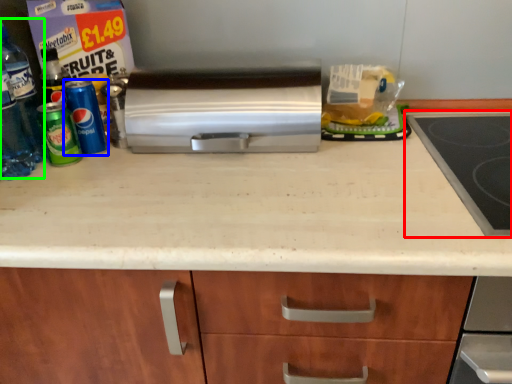
Question: Estimate the real-world distances between objects in this image. Which object is closer to gas stove (highlighted by a red box), beverage (highlighted by a blue box) or bottle (highlighted by a green box)?

Choices:
 (A) beverage
 (B) bottle

Answer: (A)